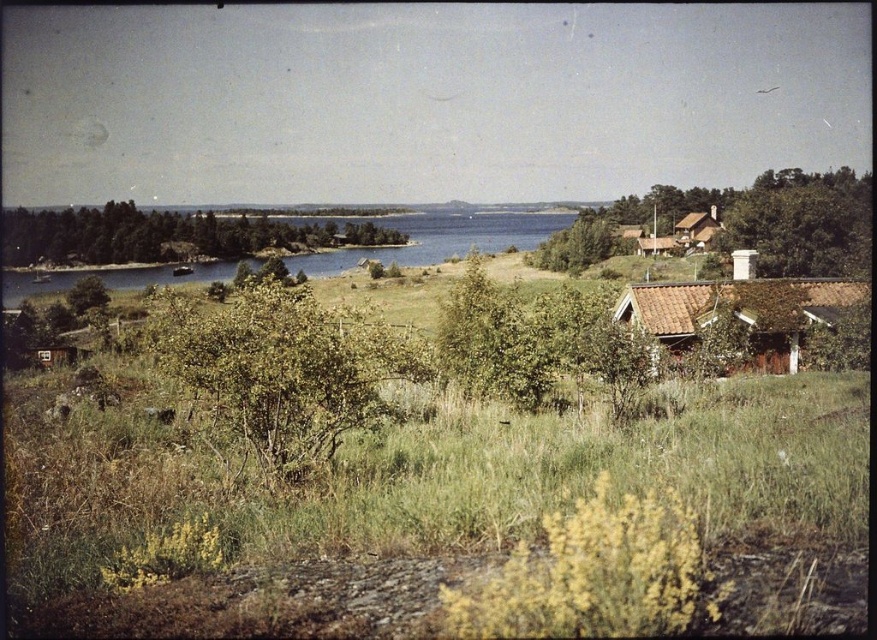
Question: Is green leafy bush at center thinner than green leafy tree at center?

Choices:
 (A) no
 (B) yes

Answer: (B)

Question: Which point is closer to the camera?

Choices:
 (A) (490, 244)
 (B) (569, 264)

Answer: (B)

Question: In this image, where is brown tiled roof hut at right located relative to brown wooden hut at upper right?

Choices:
 (A) below
 (B) above

Answer: (A)

Question: Which of the following is the farthest from the observer?

Choices:
 (A) (847, 200)
 (B) (389, 241)
 (C) (717, 211)

Answer: (B)

Question: Which is farther from the green leafy tree at center?

Choices:
 (A) brown wooden hut at upper right
 (B) green leafy tree at center-right

Answer: (A)

Question: Can you confirm if green leafy tree at center is bigger than brown tiled roof hut at right?

Choices:
 (A) no
 (B) yes

Answer: (B)